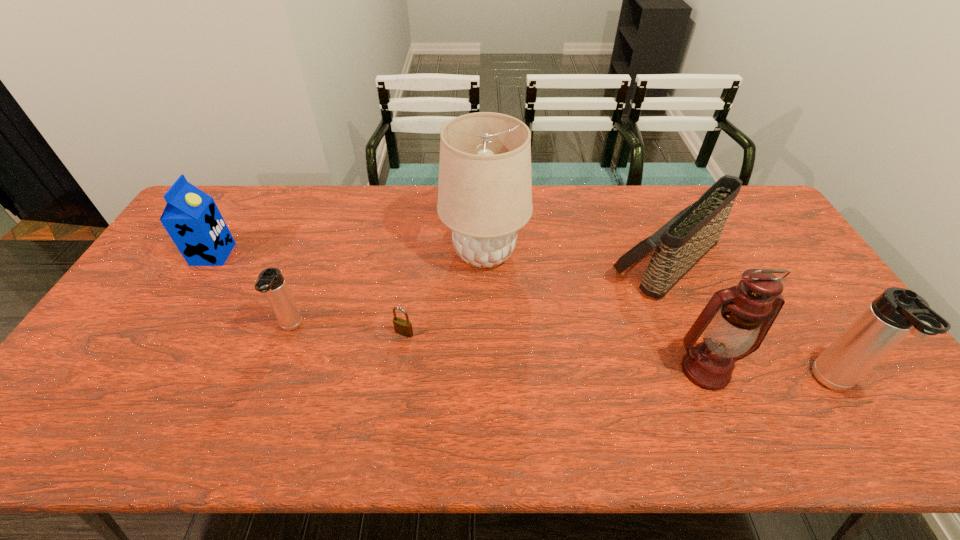
Locate an element on the screen. This screenshot has width=960, height=540. vacant space at the near right corner of the desktop is located at coordinates (853, 394).

The width and height of the screenshot is (960, 540). In order to click on empty location between the rightmost object and the oil lamp in this screenshot , I will do `click(770, 377)`.

Identify the location of blank region between the sixth object from right to left and the carton. click(252, 291).

Where is `free space between the lampshade and the farther thermos bottle`? free space between the lampshade and the farther thermos bottle is located at coordinates (388, 291).

Locate an element on the screen. vacant area that lies between the fourth object from left to right and the left thermos bottle is located at coordinates point(388,291).

The height and width of the screenshot is (540, 960). What are the coordinates of `vacant area that lies between the lampshade and the padlock` in the screenshot? It's located at (444, 293).

Where is `empty location between the fifth object from right to left and the shorter thermos bottle`? empty location between the fifth object from right to left and the shorter thermos bottle is located at coordinates (348, 330).

At what (x,y) coordinates should I click in order to perform the action: click on empty location between the leftmost object and the oil lamp. Please return your answer as a coordinate pair (x, y). Looking at the image, I should click on (459, 313).

Find the location of a particular element. The width and height of the screenshot is (960, 540). free spot between the taller thermos bottle and the third object from left to right is located at coordinates click(619, 359).

This screenshot has width=960, height=540. I want to click on empty location between the farther thermos bottle and the lampshade, so [x=388, y=291].